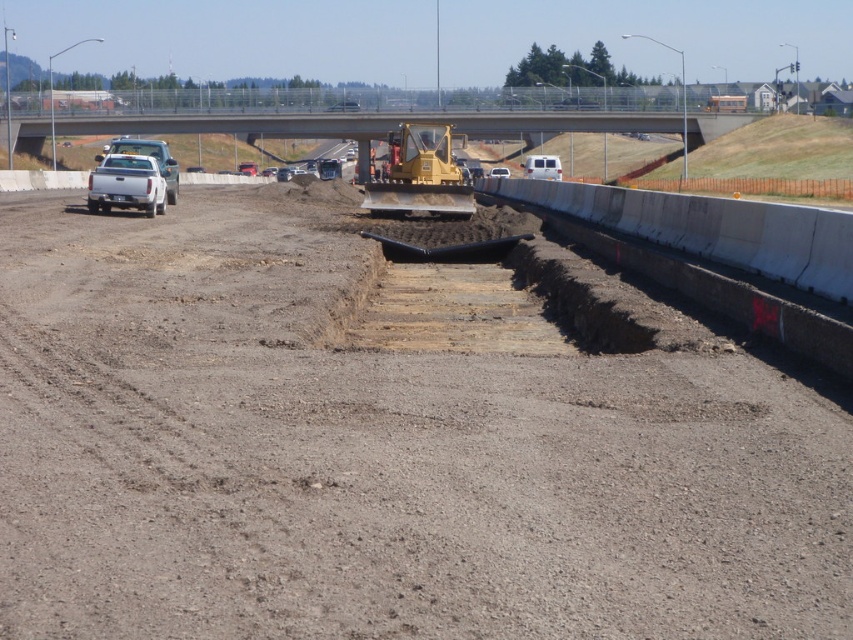
You are a construction worker standing at the edge of the highway construction site. You need to reach a specific point marked at coordinates point (761, 481). If your safety vest has a reflective strip that can be seen up to 20 feet away, will your vest be visible to a supervisor standing at the camera position?

The point (761, 481) is 19.69 feet from the camera, which is within the 20 feet visibility range of the reflective strip. Therefore, the supervisor at the camera position will be able to see the vest.